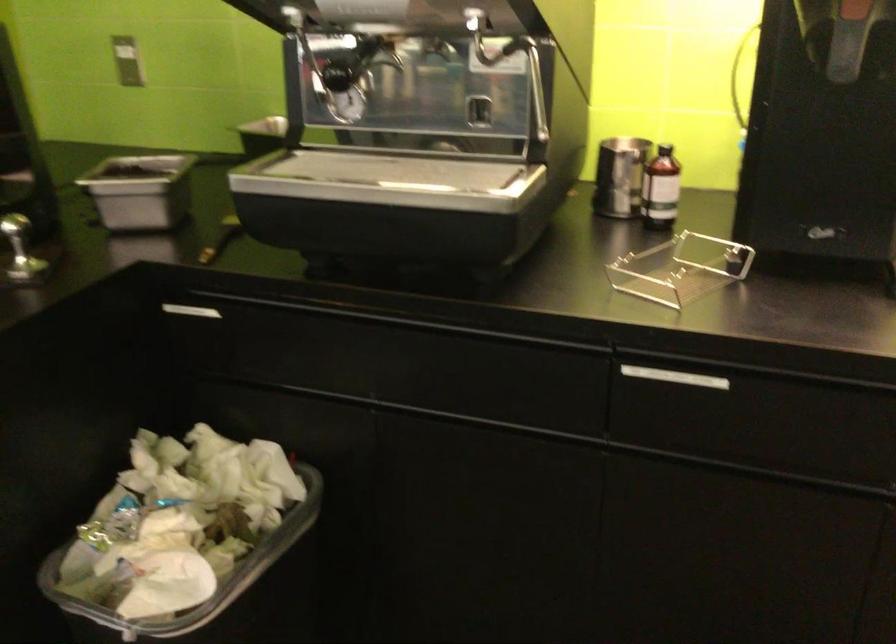
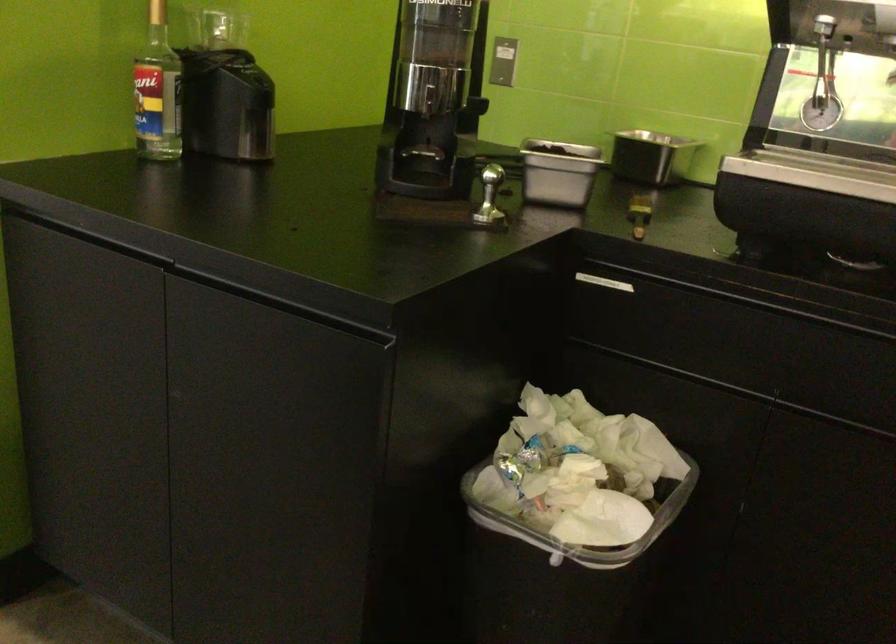
In the second image, find the point that corresponds to pixel 309 301 in the first image.

(744, 287)